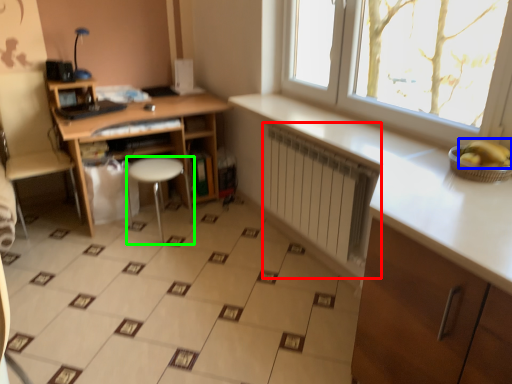
Question: Which is nearer to the radiator (highlighted by a red box)? banana (highlighted by a blue box) or stool (highlighted by a green box).

Choices:
 (A) banana
 (B) stool

Answer: (A)